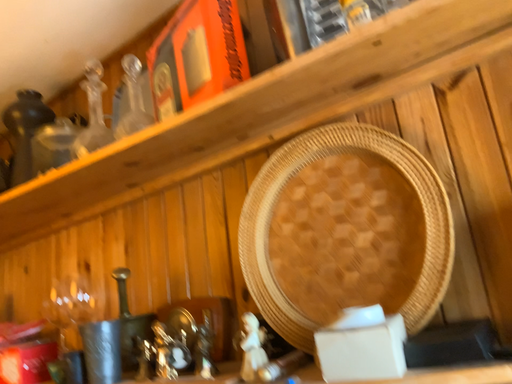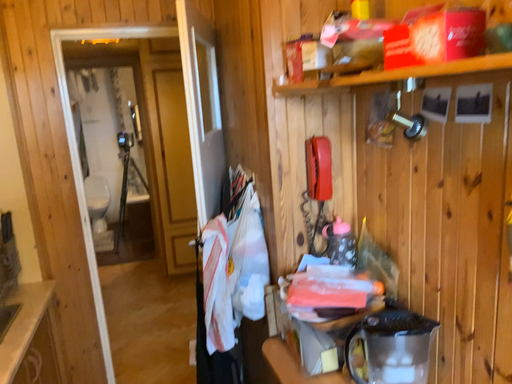
Question: How did the camera likely rotate when shooting the video?

Choices:
 (A) rotated downward
 (B) rotated upward

Answer: (A)